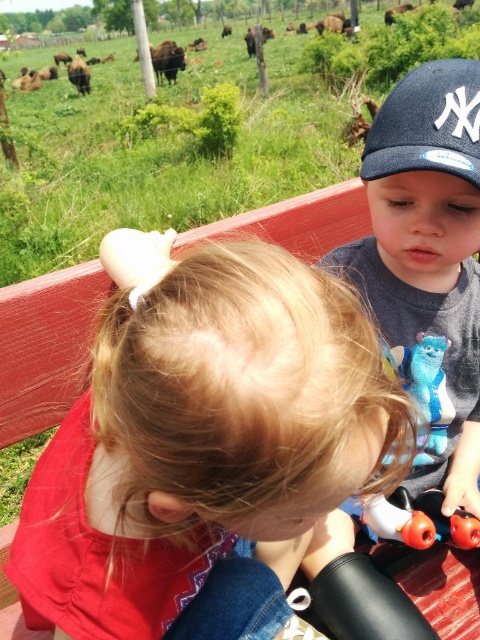
Which is more to the left, blonde hair at center or dark blue cotton cap at upper right?

From the viewer's perspective, blonde hair at center appears more on the left side.

Can you confirm if blonde hair at center is thinner than dark blue cotton cap at upper right?

In fact, blonde hair at center might be wider than dark blue cotton cap at upper right.

What do you see at coordinates (203, 433) in the screenshot? The height and width of the screenshot is (640, 480). I see `blonde hair at center` at bounding box center [203, 433].

The image size is (480, 640). I want to click on blonde hair at center, so click(203, 433).

How far apart are blonde hair at center and blue fabric baseball cap at upper right?

blonde hair at center and blue fabric baseball cap at upper right are 18.87 inches apart from each other.

Between blonde hair at center and blue fabric baseball cap at upper right, which one is positioned higher?

blue fabric baseball cap at upper right is above.

Which is in front, point (184, 528) or point (416, 68)?

Point (184, 528) is more forward.

Image resolution: width=480 pixels, height=640 pixels. Find the location of `blonde hair at center`. blonde hair at center is located at coordinates (203, 433).

Between dark blue cotton cap at upper right and blue plush toy at center, which one is positioned lower?

blue plush toy at center is below.

Is dark blue cotton cap at upper right behind blue plush toy at center?

Yes, it is behind blue plush toy at center.

The image size is (480, 640). In order to click on dark blue cotton cap at upper right in this screenshot , I will do `click(428, 262)`.

The image size is (480, 640). In order to click on dark blue cotton cap at upper right in this screenshot , I will do 428,262.